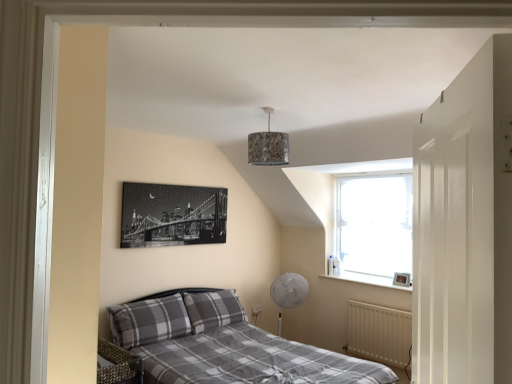
Image resolution: width=512 pixels, height=384 pixels. Find the location of `empty space that is ontop of white matte radiator at lower right (from a real-world perspective)`. empty space that is ontop of white matte radiator at lower right (from a real-world perspective) is located at coordinates (371, 302).